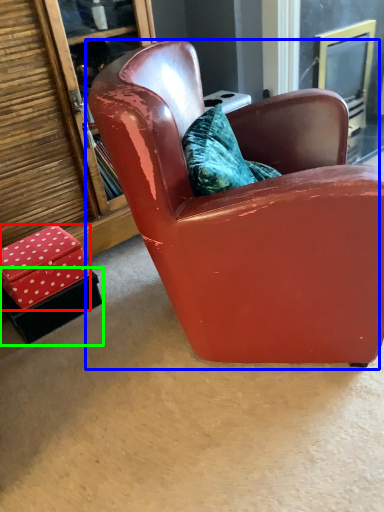
Question: Which object is positioned farthest from box (highlighted by a red box)? Select from chair (highlighted by a blue box) and box (highlighted by a green box).

Choices:
 (A) chair
 (B) box

Answer: (A)